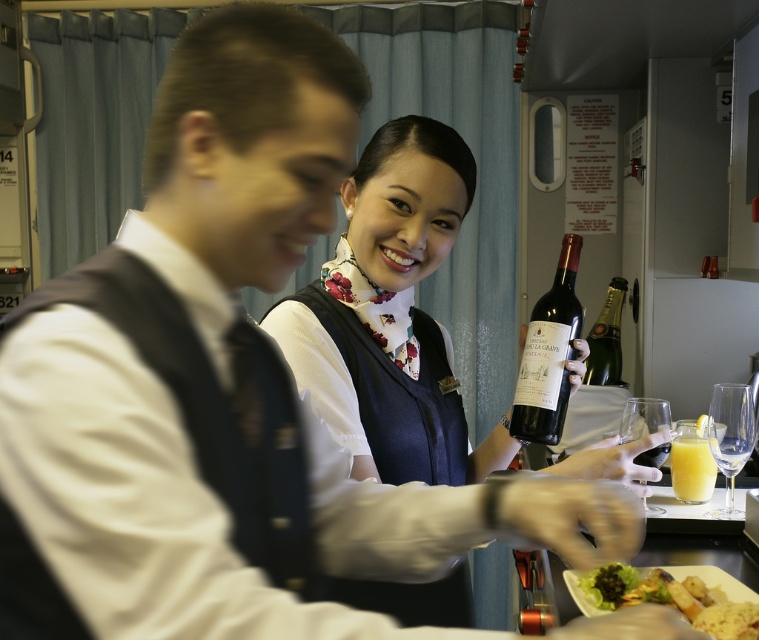
You are a passenger seated at the tray table and want to reach for the green leafy salad at lower center without disturbing the matte blue vest at center. Is the salad closer to you or further away?

The green leafy salad at lower center is further away from you than the matte blue vest at center, so it is further away.

What is the exact location of the clear glass wine glass at lower right in the image?

The clear glass wine glass at lower right is located at point (729, 436).